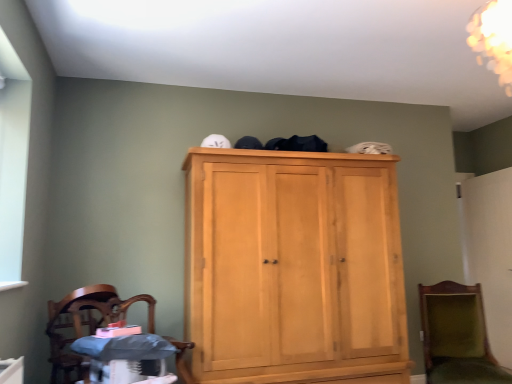
What do you see at coordinates (86, 320) in the screenshot? The image size is (512, 384). I see `wooden polished chair at lower left, which ranks as the first chair in front-to-back order` at bounding box center [86, 320].

At what (x,y) coordinates should I click in order to perform the action: click on green velvet chair at lower right, which appears as the 2th chair when viewed from the left. Please return your answer as a coordinate pair (x, y). This screenshot has height=384, width=512. Looking at the image, I should click on (457, 336).

The width and height of the screenshot is (512, 384). What do you see at coordinates (293, 267) in the screenshot? I see `light wood cupboard at center` at bounding box center [293, 267].

What do you see at coordinates (125, 357) in the screenshot?
I see `matte gray changing table at lower left` at bounding box center [125, 357].

You are a GUI agent. You are given a task and a screenshot of the screen. Output one action in this format:
    pyautogui.click(x=<x>, y=<y>)
    Task: Click on the wooden polished chair at lower left, arranged as the 2th chair when viewed from the back
    
    Given the screenshot: What is the action you would take?
    pyautogui.click(x=86, y=320)

Which is in front, wooden polished chair at lower left, which ranks as the first chair in front-to-back order, or matte gray changing table at lower left?

wooden polished chair at lower left, which ranks as the first chair in front-to-back order, is in front.

How different are the orientations of wooden polished chair at lower left, which is the 2th chair in right-to-left order, and matte gray changing table at lower left in degrees?

They differ by 2.75 degrees in their facing directions.

Does wooden polished chair at lower left, which is the 2th chair in right-to-left order, have a smaller size compared to matte gray changing table at lower left?

Incorrect, wooden polished chair at lower left, which is the 2th chair in right-to-left order, is not smaller in size than matte gray changing table at lower left.

Which object is positioned more to the right, wooden polished chair at lower left, arranged as the 1th chair when viewed from the left, or matte gray changing table at lower left?

Positioned to the right is wooden polished chair at lower left, arranged as the 1th chair when viewed from the left.

Which object is closer to the camera, matte gray changing table at lower left or wooden polished chair at lower left, which ranks as the first chair in front-to-back order?

Positioned in front is wooden polished chair at lower left, which ranks as the first chair in front-to-back order.

Is point (96, 380) positioned in front of point (76, 303)?

Yes.

Can you see matte gray changing table at lower left touching wooden polished chair at lower left, arranged as the 1th chair when viewed from the left?

No, matte gray changing table at lower left is not making contact with wooden polished chair at lower left, arranged as the 1th chair when viewed from the left.

Between matte gray changing table at lower left and wooden polished chair at lower left, which ranks as the first chair in front-to-back order, which one has smaller size?

matte gray changing table at lower left is smaller.

Would you say green velvet chair at lower right, the second chair viewed from the front, is inside or outside light wood cupboard at center?

green velvet chair at lower right, the second chair viewed from the front, cannot be found inside light wood cupboard at center.

Who is taller, green velvet chair at lower right, which appears as the first chair when viewed from the back, or light wood cupboard at center?

With more height is light wood cupboard at center.

Who is smaller, green velvet chair at lower right, the second chair viewed from the front, or light wood cupboard at center?

With smaller size is green velvet chair at lower right, the second chair viewed from the front.

Based on their sizes in the image, would you say light wood cupboard at center is bigger or smaller than matte gray changing table at lower left?

light wood cupboard at center is bigger than matte gray changing table at lower left.

Considering the sizes of light wood cupboard at center and matte gray changing table at lower left in the image, is light wood cupboard at center taller or shorter than matte gray changing table at lower left?

Considering their sizes, light wood cupboard at center has more height than matte gray changing table at lower left.

Locate an element on the screen. cupboard on the right of matte gray changing table at lower left is located at coordinates (293, 267).

From the image's perspective, is light wood cupboard at center located above or below matte gray changing table at lower left?

light wood cupboard at center is situated higher than matte gray changing table at lower left in the image.

Can you confirm if matte gray changing table at lower left is wider than green velvet chair at lower right, which appears as the first chair when viewed from the back?

No, matte gray changing table at lower left is not wider than green velvet chair at lower right, which appears as the first chair when viewed from the back.

Who is taller, matte gray changing table at lower left or green velvet chair at lower right, the second chair viewed from the front?

Standing taller between the two is green velvet chair at lower right, the second chair viewed from the front.

From a real-world perspective, between matte gray changing table at lower left and green velvet chair at lower right, which appears as the first chair when viewed from the back, who is vertically higher?

From a 3D spatial view, matte gray changing table at lower left is above.

Is the depth of matte gray changing table at lower left greater than that of green velvet chair at lower right, which appears as the 2th chair when viewed from the left?

No, matte gray changing table at lower left is closer to the camera.

Where is `chair lying behind the light wood cupboard at center`? chair lying behind the light wood cupboard at center is located at coordinates (457, 336).

From a real-world perspective, which is physically below, light wood cupboard at center or green velvet chair at lower right, which appears as the 2th chair when viewed from the left?

green velvet chair at lower right, which appears as the 2th chair when viewed from the left, from a real-world perspective.

In the scene shown: Which of these two, light wood cupboard at center or green velvet chair at lower right, the second chair viewed from the front, stands taller?

Standing taller between the two is light wood cupboard at center.

Measure the distance between light wood cupboard at center and green velvet chair at lower right, which appears as the first chair when viewed from the back.

Result: The distance of light wood cupboard at center from green velvet chair at lower right, which appears as the first chair when viewed from the back, is 38.55 inches.

Where is `cupboard above the wooden polished chair at lower left, arranged as the 1th chair when viewed from the left (from the image's perspective)`? The width and height of the screenshot is (512, 384). cupboard above the wooden polished chair at lower left, arranged as the 1th chair when viewed from the left (from the image's perspective) is located at coordinates (293, 267).

Which of these two, light wood cupboard at center or wooden polished chair at lower left, arranged as the 1th chair when viewed from the left, stands taller?

Standing taller between the two is light wood cupboard at center.

Between light wood cupboard at center and wooden polished chair at lower left, which ranks as the first chair in front-to-back order, which one appears on the left side from the viewer's perspective?

Positioned to the left is wooden polished chair at lower left, which ranks as the first chair in front-to-back order.

Is light wood cupboard at center positioned in front of wooden polished chair at lower left, arranged as the 2th chair when viewed from the back?

No.

Identify the location of changing table on the left of wooden polished chair at lower left, which ranks as the first chair in front-to-back order. (125, 357).

Identify the location of changing table behind the wooden polished chair at lower left, arranged as the 2th chair when viewed from the back. (125, 357).

Which object lies nearer to the anchor point matte gray changing table at lower left, wooden polished chair at lower left, arranged as the 2th chair when viewed from the back, or green velvet chair at lower right, the 1th chair when ordered from right to left?

Among the two, wooden polished chair at lower left, arranged as the 2th chair when viewed from the back, is located nearer to matte gray changing table at lower left.

Considering their positions, is matte gray changing table at lower left positioned further to green velvet chair at lower right, which appears as the 2th chair when viewed from the left, than wooden polished chair at lower left, which ranks as the first chair in front-to-back order?

wooden polished chair at lower left, which ranks as the first chair in front-to-back order, is further to green velvet chair at lower right, which appears as the 2th chair when viewed from the left.

Considering their positions, is wooden polished chair at lower left, arranged as the 2th chair when viewed from the back, positioned further to green velvet chair at lower right, the 1th chair when ordered from right to left, than matte gray changing table at lower left?

wooden polished chair at lower left, arranged as the 2th chair when viewed from the back, lies further to green velvet chair at lower right, the 1th chair when ordered from right to left, than the other object.

Which object lies further to the anchor point matte gray changing table at lower left, wooden polished chair at lower left, arranged as the 1th chair when viewed from the left, or light wood cupboard at center?

light wood cupboard at center lies further to matte gray changing table at lower left than the other object.

From the image, which object appears to be nearer to wooden polished chair at lower left, which is the 2th chair in right-to-left order, light wood cupboard at center or green velvet chair at lower right, which appears as the first chair when viewed from the back?

light wood cupboard at center lies closer to wooden polished chair at lower left, which is the 2th chair in right-to-left order, than the other object.

From the image, which object appears to be farther from matte gray changing table at lower left, light wood cupboard at center or wooden polished chair at lower left, which is the 2th chair in right-to-left order?

Among the two, light wood cupboard at center is located further to matte gray changing table at lower left.

Looking at this image, based on their spatial positions, is matte gray changing table at lower left or light wood cupboard at center further from green velvet chair at lower right, the second chair viewed from the front?

matte gray changing table at lower left is further to green velvet chair at lower right, the second chair viewed from the front.

Based on their spatial positions, is wooden polished chair at lower left, arranged as the 1th chair when viewed from the left, or light wood cupboard at center further from green velvet chair at lower right, the 1th chair when ordered from right to left?

wooden polished chair at lower left, arranged as the 1th chair when viewed from the left, is positioned further to the anchor green velvet chair at lower right, the 1th chair when ordered from right to left.

At what (x,y) coordinates should I click in order to perform the action: click on chair between matte gray changing table at lower left and green velvet chair at lower right, which appears as the 2th chair when viewed from the left. Please return your answer as a coordinate pair (x, y). Image resolution: width=512 pixels, height=384 pixels. Looking at the image, I should click on (86, 320).

The height and width of the screenshot is (384, 512). What are the coordinates of `chair between matte gray changing table at lower left and light wood cupboard at center` in the screenshot? It's located at (86, 320).

The height and width of the screenshot is (384, 512). In order to click on cupboard situated between matte gray changing table at lower left and green velvet chair at lower right, which appears as the 2th chair when viewed from the left, from left to right in this screenshot , I will do `click(293, 267)`.

Find the location of a particular element. This screenshot has height=384, width=512. cupboard between wooden polished chair at lower left, arranged as the 1th chair when viewed from the left, and green velvet chair at lower right, the second chair viewed from the front is located at coordinates (293, 267).